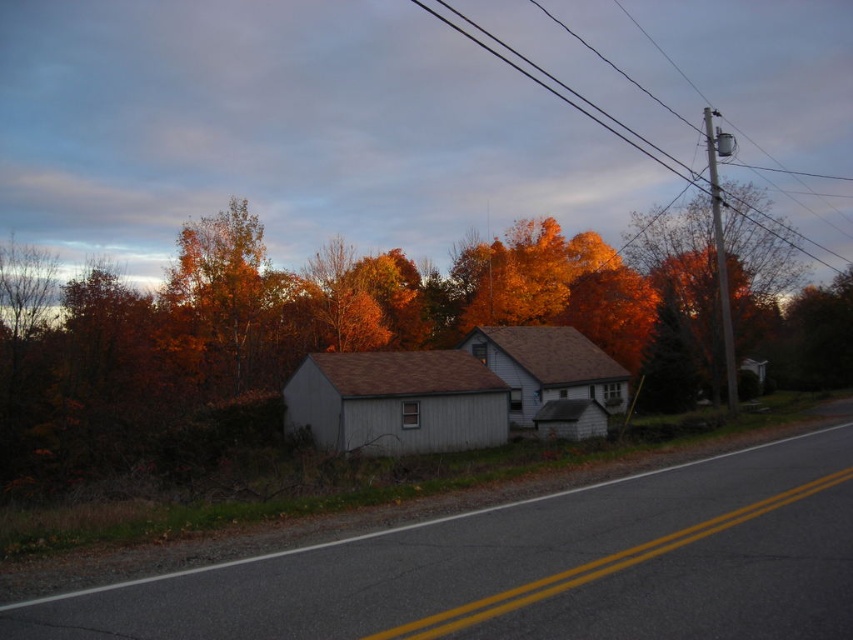
Based on the photo, is orange leaves at center shorter than metallic wire at upper center?

Indeed, orange leaves at center has a lesser height compared to metallic wire at upper center.

Who is more distant from viewer, [593,314] or [695,125]?

Point [695,125]

This screenshot has height=640, width=853. Identify the location of orange leaves at center. (297, 333).